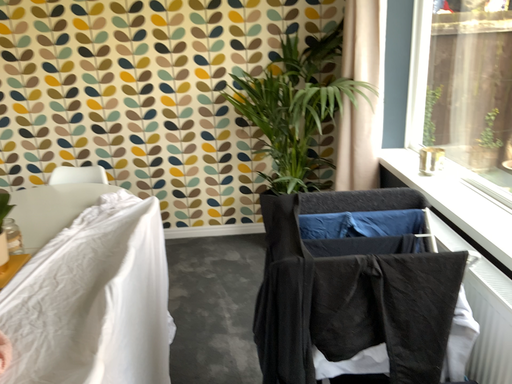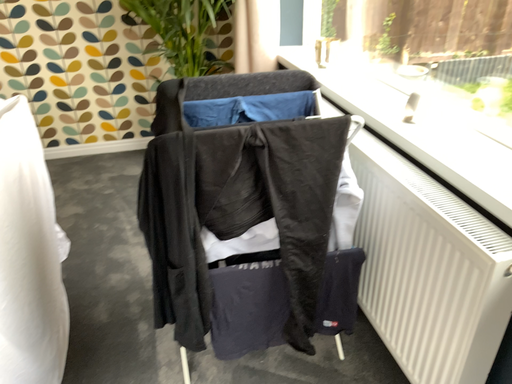
Question: How did the camera likely rotate when shooting the video?

Choices:
 (A) rotated downward
 (B) rotated upward

Answer: (A)